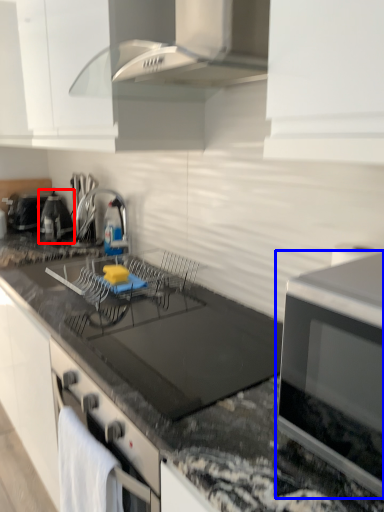
Question: Which object is closer to the camera taking this photo, appliance (highlighted by a red box) or kitchen appliance (highlighted by a blue box)?

Choices:
 (A) appliance
 (B) kitchen appliance

Answer: (B)